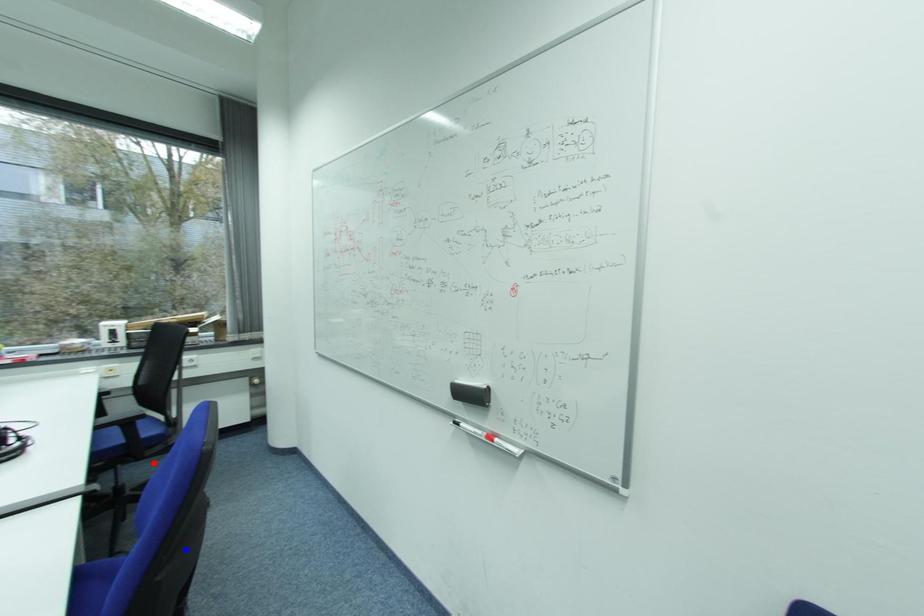
Question: In the image, two points are highlighted. Which point is nearer to the camera? Reply with the corresponding letter.

Choices:
 (A) blue point
 (B) red point

Answer: (A)